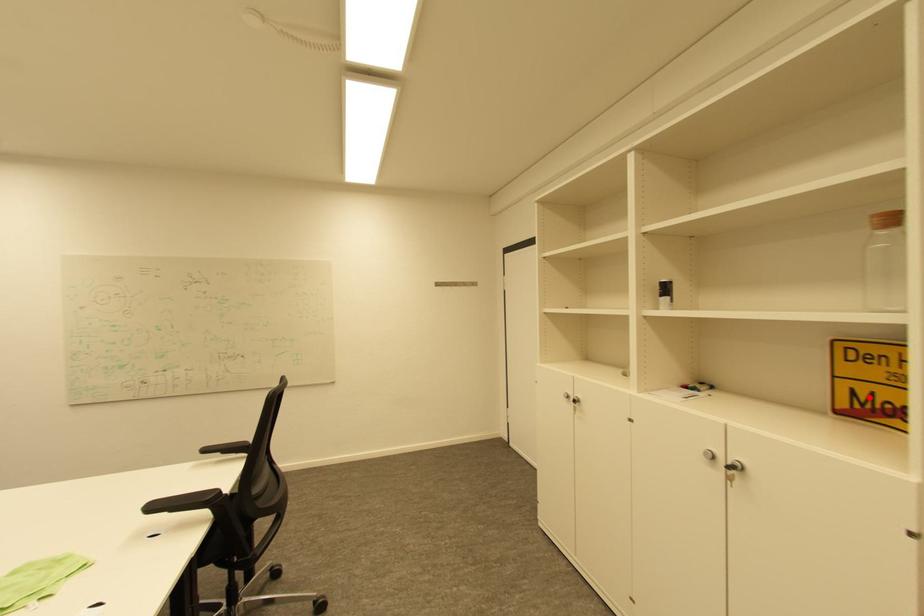
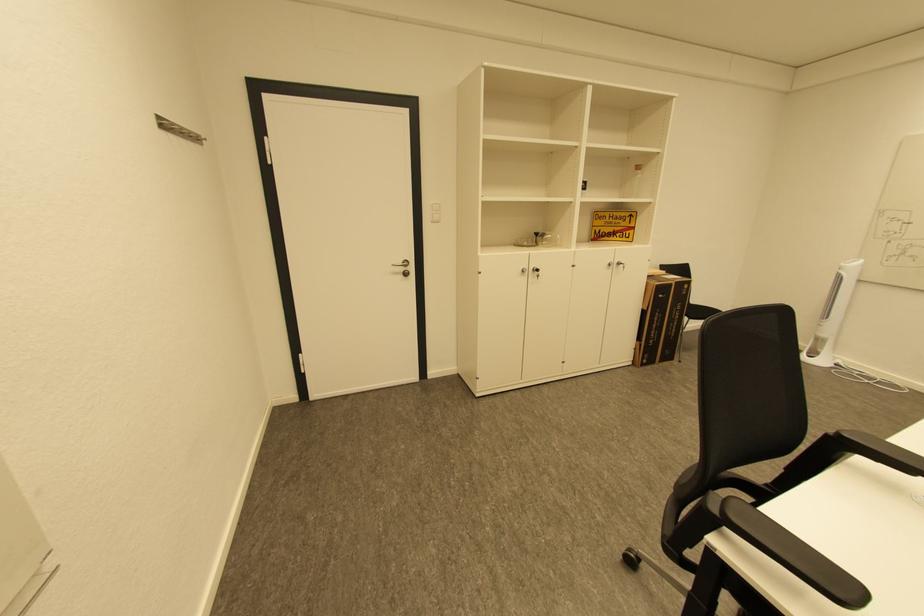
The point at the highlighted location is marked in the first image. Where is the corresponding point in the second image?

(603, 233)